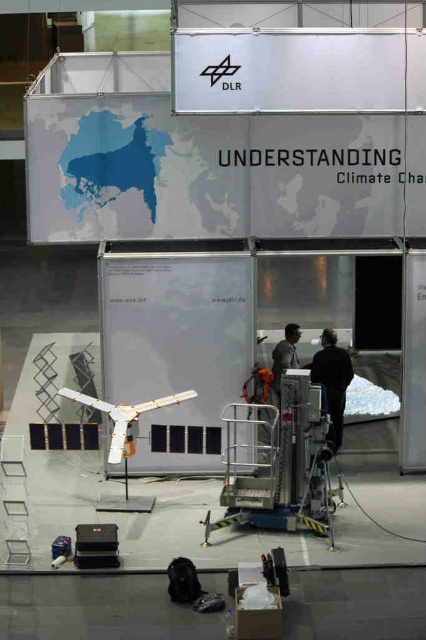
Does metallic silver platform at center appear on the right side of black matte jacket at center?

Incorrect, metallic silver platform at center is not on the right side of black matte jacket at center.

Measure the distance between metallic silver platform at center and camera.

The distance of metallic silver platform at center from camera is 7.50 meters.

Is point (287, 465) farther from camera compared to point (347, 362)?

No, it is in front of (347, 362).

Image resolution: width=426 pixels, height=640 pixels. I want to click on metallic silver platform at center, so tap(276, 461).

Is metallic silver platform at center below white plastic satellite at center?

Yes.

Does metallic silver platform at center have a larger size compared to white plastic satellite at center?

Correct, metallic silver platform at center is larger in size than white plastic satellite at center.

This screenshot has height=640, width=426. I want to click on metallic silver platform at center, so click(x=276, y=461).

Who is higher up, white plastic satellite at center or dark gray fabric jacket at center?

dark gray fabric jacket at center is above.

Does white plastic satellite at center appear under dark gray fabric jacket at center?

Yes.

What do you see at coordinates (123, 413) in the screenshot? I see `white plastic satellite at center` at bounding box center [123, 413].

The width and height of the screenshot is (426, 640). What are the coordinates of `white plastic satellite at center` in the screenshot? It's located at (123, 413).